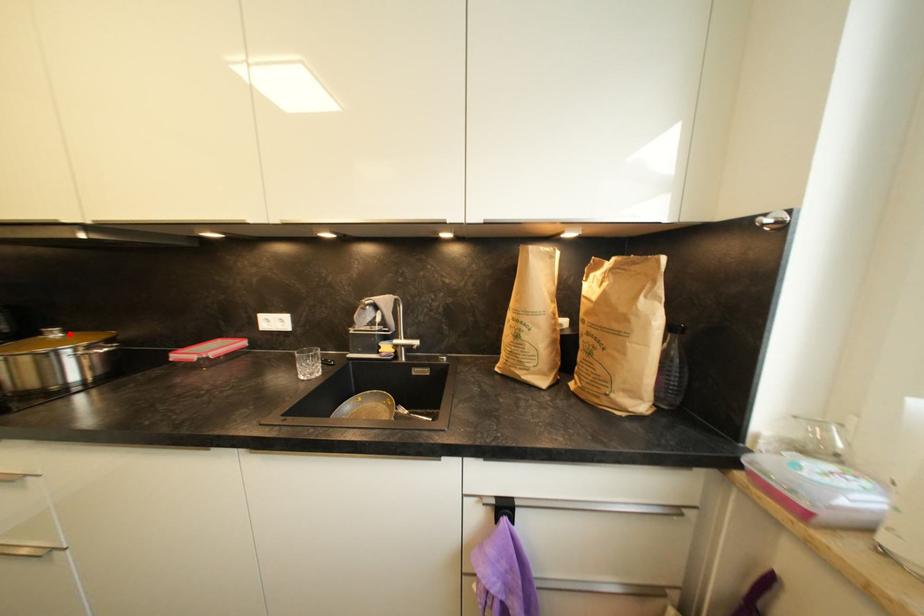
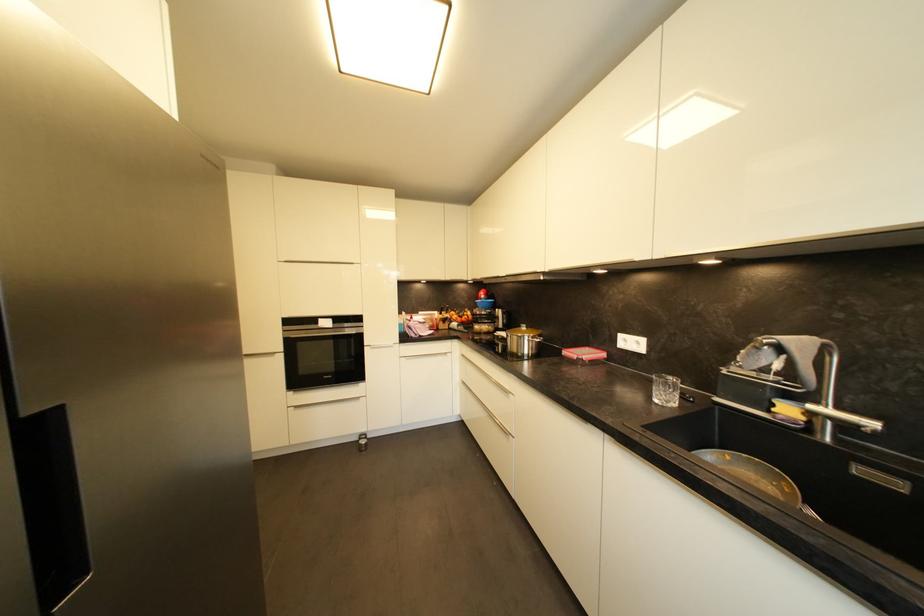
Find the pixel in the second image that matches the highlighted location in the first image.

(531, 330)